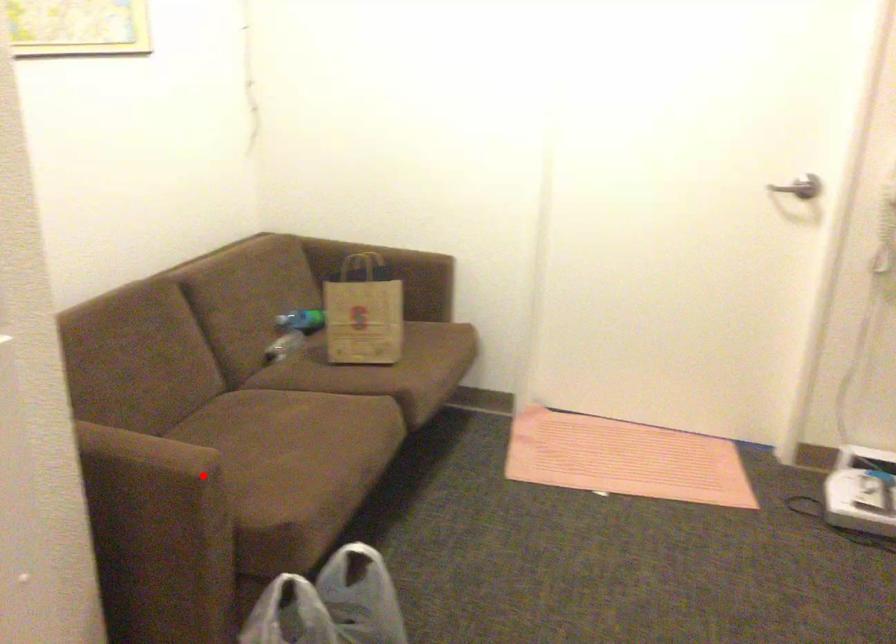
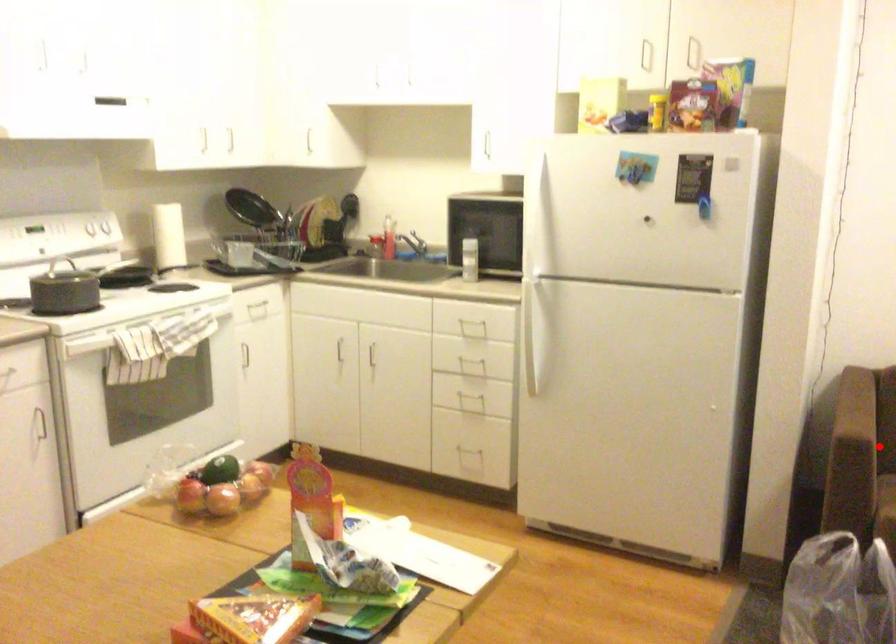
I am providing you with two images of the same scene from different viewpoints. A red point is marked on the first image and another point is marked on the second image. Does the point marked in image1 correspond to the same location as the one in image2?

Yes